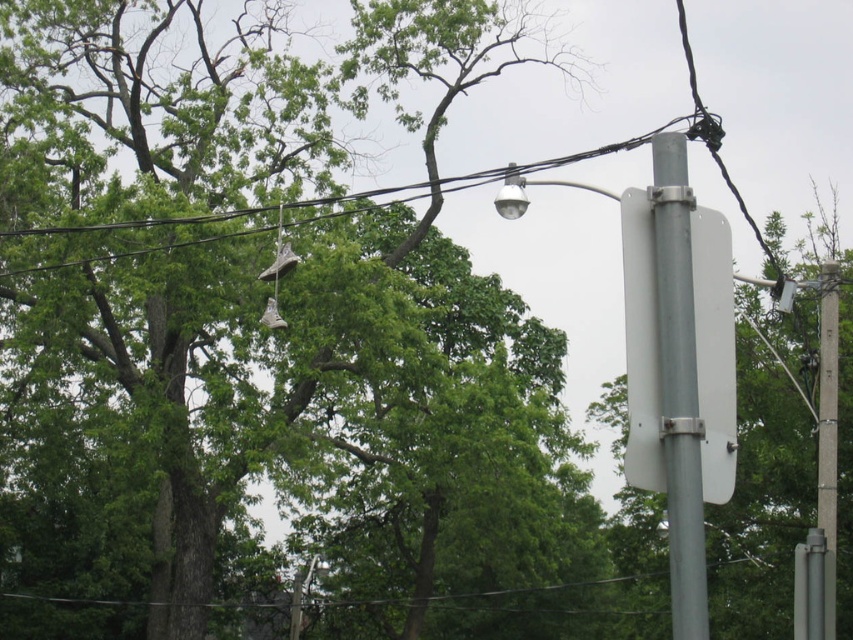
Which is in front, point (666, 417) or point (633, 369)?

Point (666, 417)

This screenshot has height=640, width=853. Describe the element at coordinates (672, 368) in the screenshot. I see `metallic gray street light at center right` at that location.

Is point (631, 401) in front of point (637, 333)?

Yes.

What are the coordinates of `metallic gray street light at center right` in the screenshot? It's located at (672, 368).

Which is more to the left, metallic gray street light at center right or silver metallic pole at right?

silver metallic pole at right is more to the left.

Identify the location of metallic gray street light at center right. (672, 368).

Describe the element at coordinates (672, 368) in the screenshot. This screenshot has width=853, height=640. I see `metallic gray street light at center right` at that location.

This screenshot has width=853, height=640. I want to click on metallic gray street light at center right, so click(x=672, y=368).

Does green leafy tree at upper center appear over silver metallic pole at right?

Correct, green leafy tree at upper center is located above silver metallic pole at right.

Who is more forward, (320,337) or (669,429)?

Point (669,429) is in front.

This screenshot has height=640, width=853. What do you see at coordinates (254, 333) in the screenshot? I see `green leafy tree at upper center` at bounding box center [254, 333].

This screenshot has width=853, height=640. What are the coordinates of `green leafy tree at upper center` in the screenshot? It's located at (254, 333).